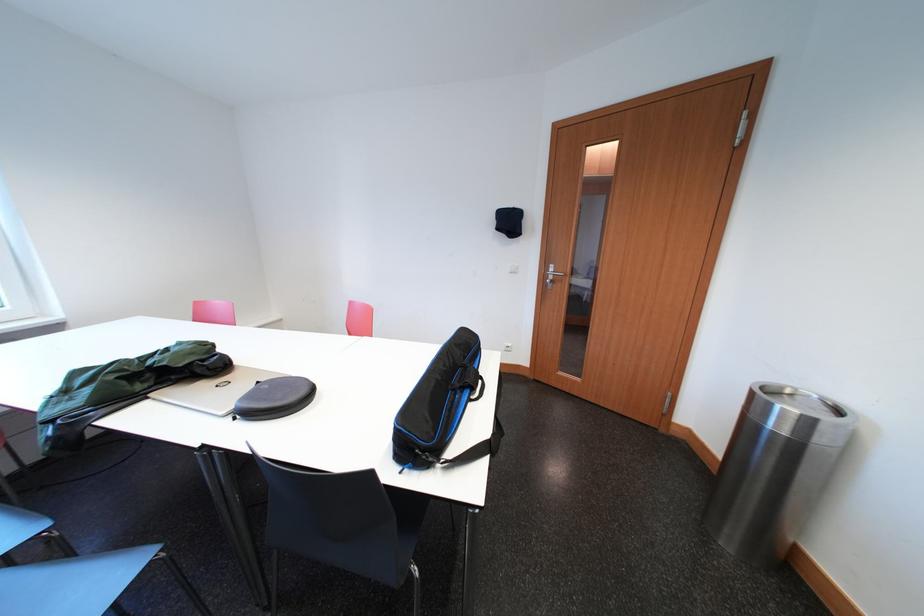
Image resolution: width=924 pixels, height=616 pixels. What do you see at coordinates (799, 414) in the screenshot? I see `a trash can lid` at bounding box center [799, 414].